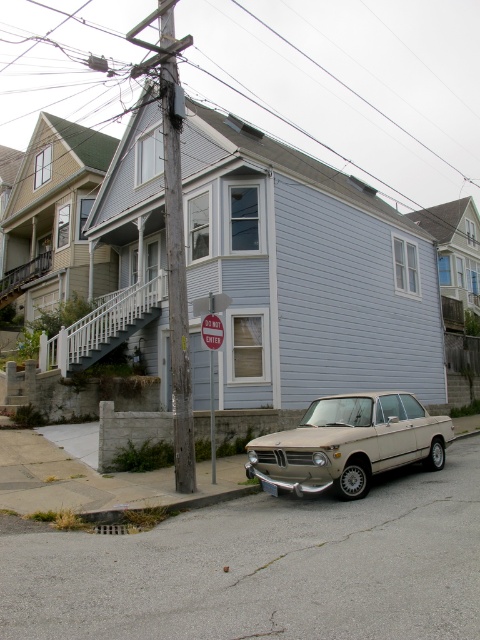
From the picture: Who is lower down, metallic wire at upper center or beige matte sedan at center?

Positioned lower is beige matte sedan at center.

Find the location of a particular element. metallic wire at upper center is located at coordinates [x=349, y=83].

Is wooden utility pole at center closer to the viewer compared to gray concrete curb at lower center?

No.

Does wooden utility pole at center appear under gray concrete curb at lower center?

No.

Where is `wooden utility pole at center`? This screenshot has height=640, width=480. wooden utility pole at center is located at coordinates [x=172, y=230].

Does metallic wire at upper center appear over wooden utility pole at center?

Yes, metallic wire at upper center is above wooden utility pole at center.

Is point (379, 36) in front of point (180, 285)?

No, it is behind (180, 285).

Identify the location of metallic wire at upper center. (349, 83).